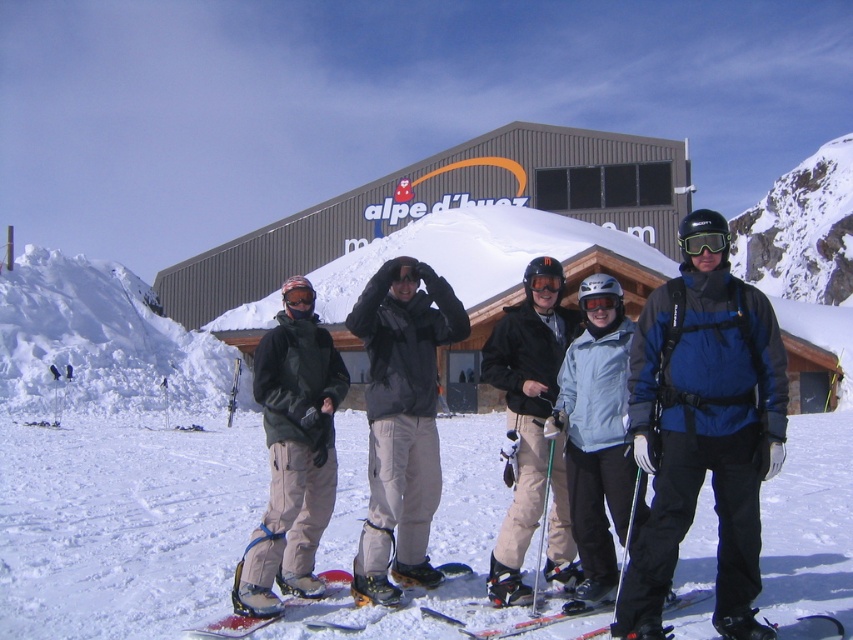
Between dark gray fleece jacket at center and light blue fabric jacket at center, which one has less height?

light blue fabric jacket at center

Find the location of a particular element. dark gray fleece jacket at center is located at coordinates (292, 460).

The width and height of the screenshot is (853, 640). Find the location of `dark gray fleece jacket at center`. dark gray fleece jacket at center is located at coordinates (292, 460).

Is point (738, 522) more distant than point (300, 300)?

No.

Can you confirm if blue matte jacket at center is positioned to the left of black matte goggles at center?

No, blue matte jacket at center is not to the left of black matte goggles at center.

Locate an element on the screen. This screenshot has width=853, height=640. blue matte jacket at center is located at coordinates (703, 436).

Does dark gray fleece jacket at center appear over black matte ski goggles at center?

No.

Which is in front, point (332, 380) or point (699, 236)?

Point (699, 236) is in front.

Who is more distant from viewer, [271,416] or [727,243]?

The point [271,416] is behind.

Identify the location of dark gray fleece jacket at center. The image size is (853, 640). (292, 460).